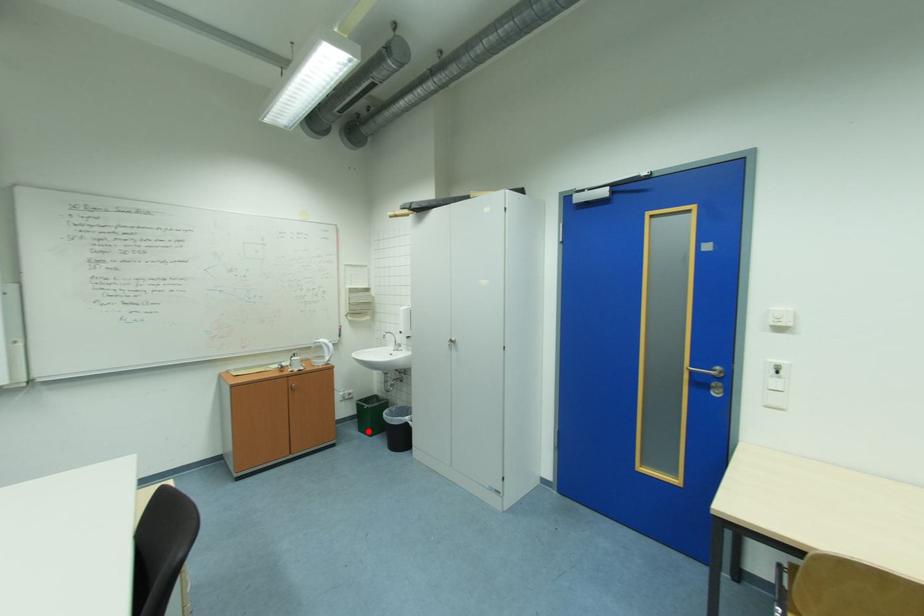
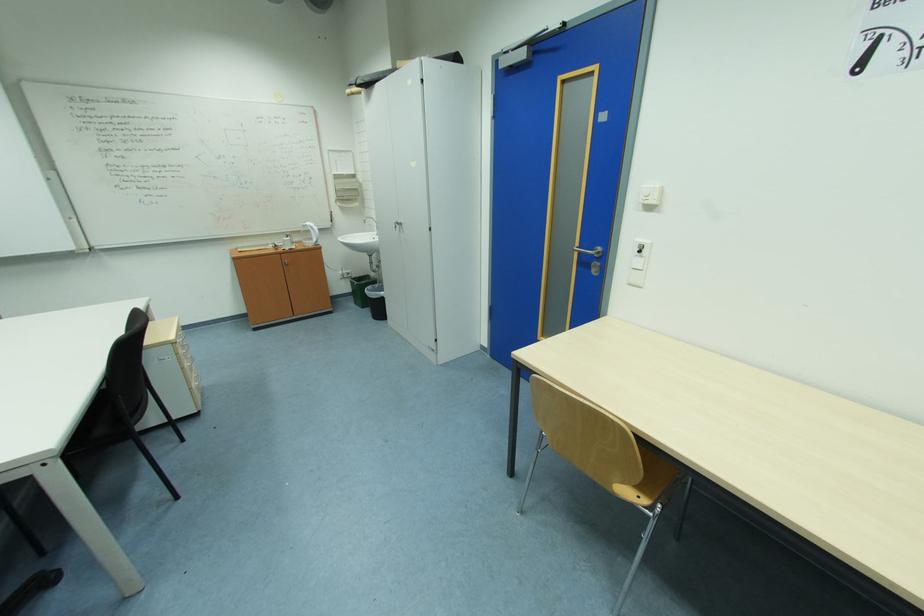
Question: I am providing you with two images of the same scene from different viewpoints. A red point is shown in image1. For the corresponding object point in image2, is it positioned nearer or farther from the camera?

Choices:
 (A) Nearer
 (B) Farther

Answer: (A)